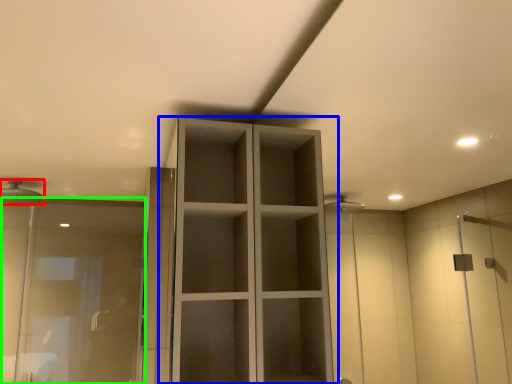
Question: Estimate the real-world distances between objects in this image. Which object is closer to shower (highlighted by a red box), cupboard (highlighted by a blue box) or screen door (highlighted by a green box)?

Choices:
 (A) cupboard
 (B) screen door

Answer: (B)